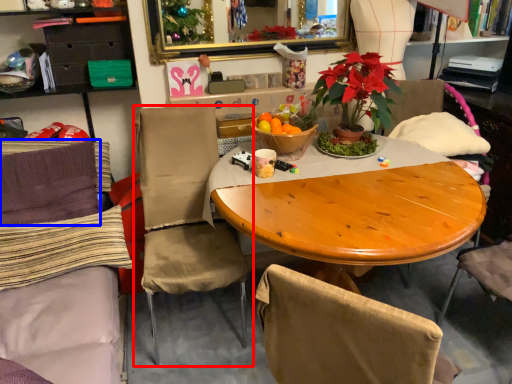
Question: Which of the following is the closest to the observer, chair (highlighted by a red box) or pillow (highlighted by a blue box)?

Choices:
 (A) chair
 (B) pillow

Answer: (A)